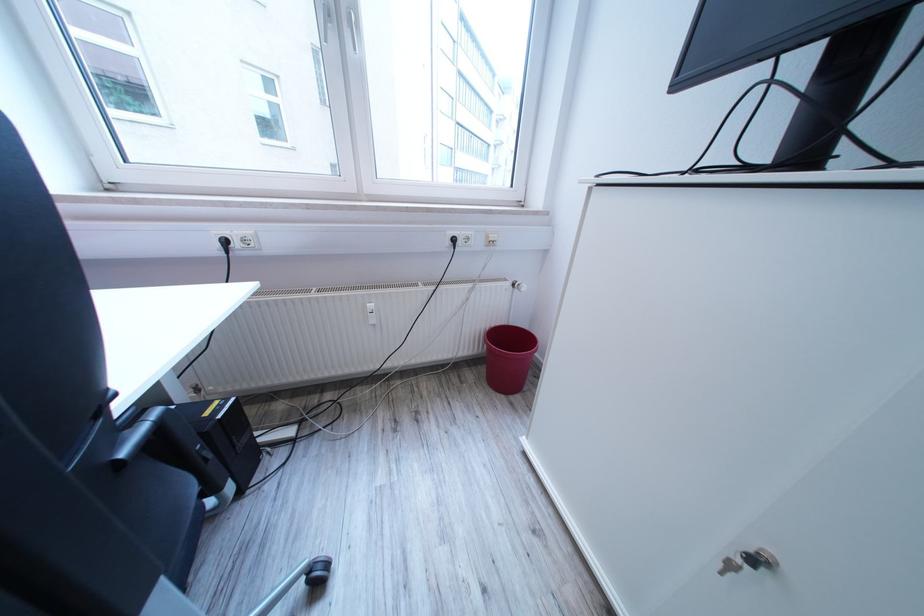
The width and height of the screenshot is (924, 616). Describe the element at coordinates (748, 562) in the screenshot. I see `a key in cabinet lock` at that location.